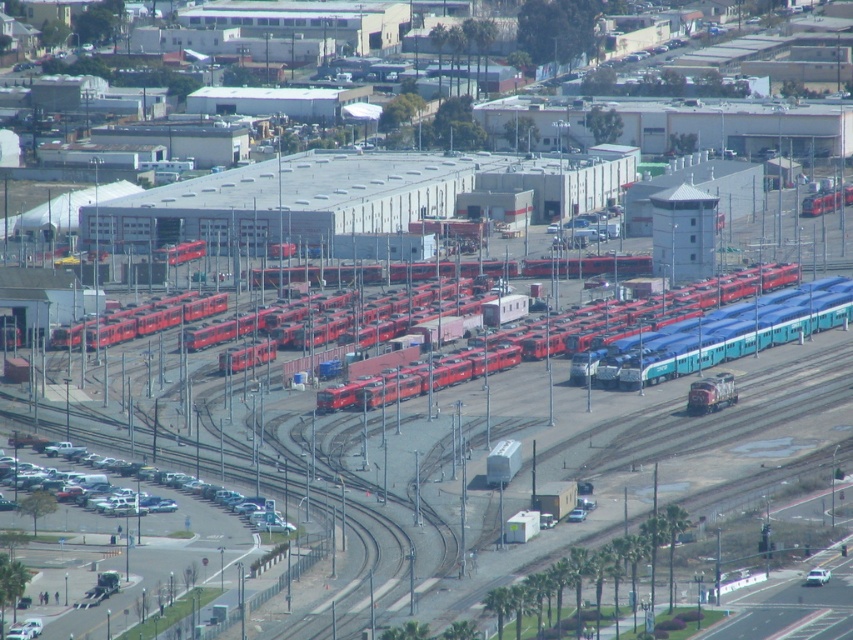
Is point (706, 397) farther from viewer compared to point (827, 211)?

No, it is in front of (827, 211).

Measure the distance between point (720, 404) and camera.

The distance of point (720, 404) from camera is 657.71 meters.

Does point (718, 381) lie in front of point (810, 212)?

Yes, point (718, 381) is closer to viewer.

Identify the location of reddish-brown metallic train car at lower right. The height and width of the screenshot is (640, 853). (711, 394).

Is point (659, 332) positioned before point (718, 390)?

That is True.

Locate an element on the screen. teal glossy train at right is located at coordinates (717, 336).

Where is `teal glossy train at right`? teal glossy train at right is located at coordinates (717, 336).

Between point (370, 380) and point (817, 202), which one is positioned in front?

Point (370, 380) is in front.

The height and width of the screenshot is (640, 853). I want to click on matte red train at center, so click(564, 336).

The width and height of the screenshot is (853, 640). In order to click on matte red train at center in this screenshot , I will do `click(564, 336)`.